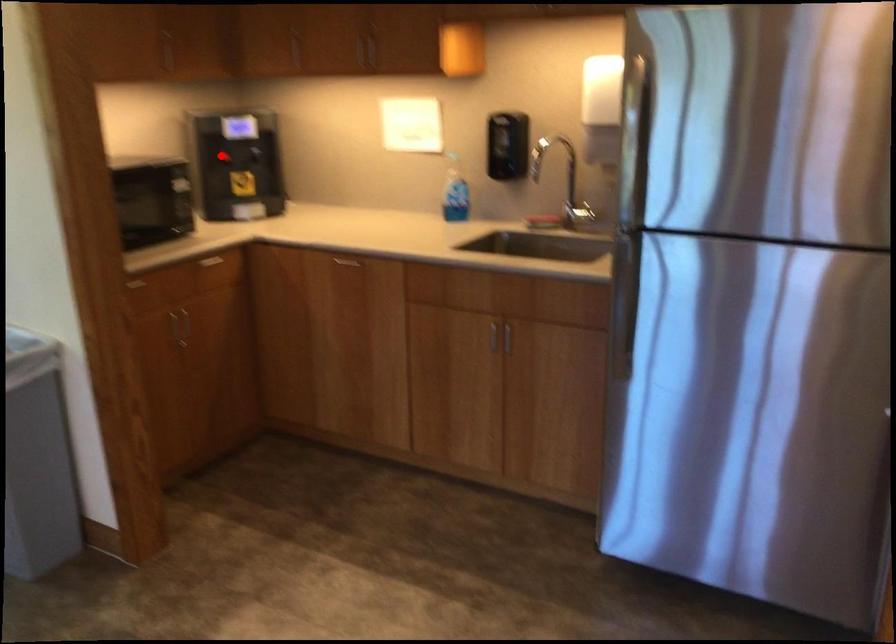
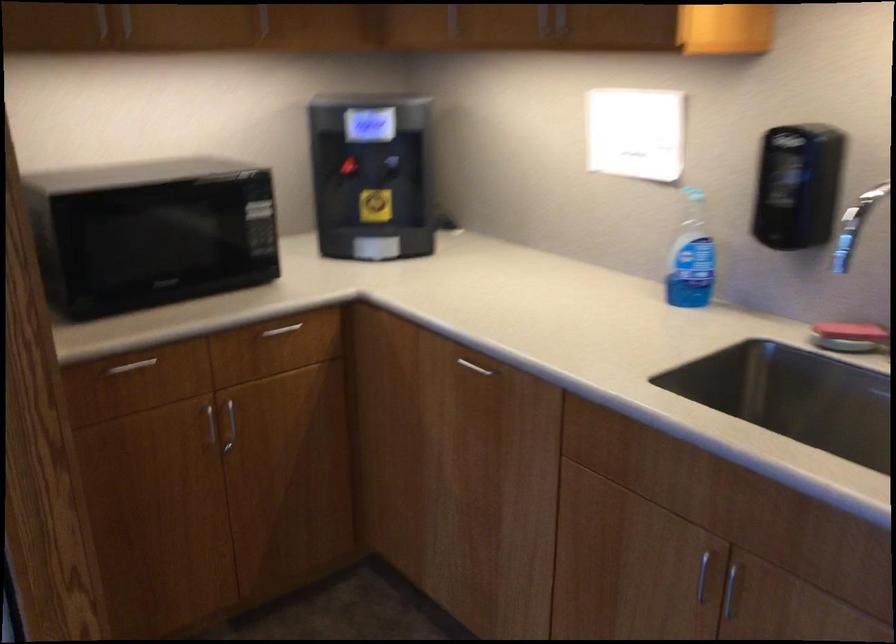
In the second image, find the point that corresponds to the highlighted location in the first image.

(345, 167)